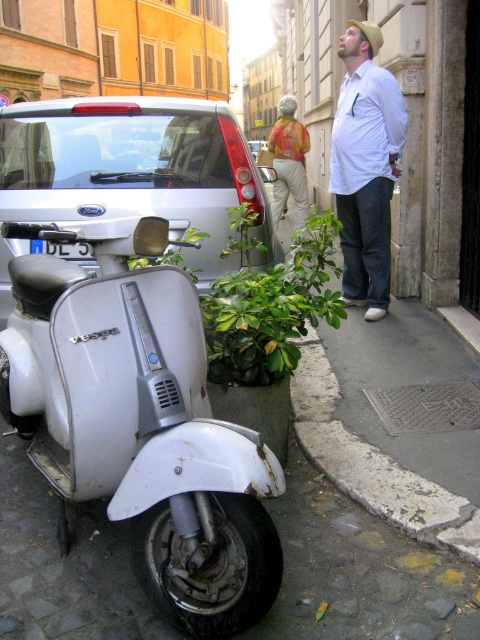
Question: Is silver metallic scooter at left below blue plastic license plate at lower left?

Choices:
 (A) yes
 (B) no

Answer: (B)

Question: Is white matte scooter at lower left to the left of silver metallic scooter at left from the viewer's perspective?

Choices:
 (A) no
 (B) yes

Answer: (A)

Question: Which point is farther to the camera?

Choices:
 (A) (393, 157)
 (B) (107, 376)
 (C) (220, 125)
 (D) (69, 257)

Answer: (A)

Question: Considering the relative positions of silver metallic scooter at left and white cotton shirt at upper center in the image provided, where is silver metallic scooter at left located with respect to white cotton shirt at upper center?

Choices:
 (A) above
 (B) below

Answer: (B)

Question: Among these points, which one is nearest to the camera?

Choices:
 (A) pos(342,177)
 (B) pos(49,252)

Answer: (B)

Question: Which of these objects is positioned closest to the silver metallic scooter at left?

Choices:
 (A) white matte scooter at lower left
 (B) blue plastic license plate at lower left
 (C) white cotton shirt at upper center

Answer: (B)